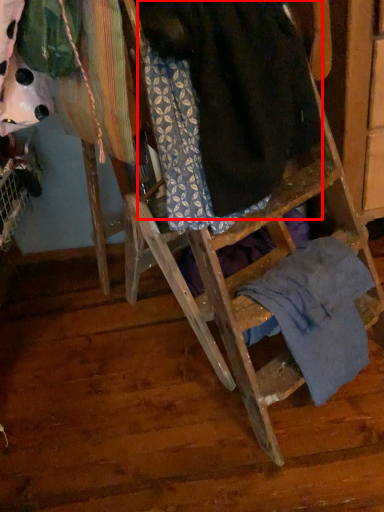
Question: Considering the relative positions of wool (annotated by the red box) and underclothes in the image provided, where is wool (annotated by the red box) located with respect to the staircase?

Choices:
 (A) left
 (B) right

Answer: (A)